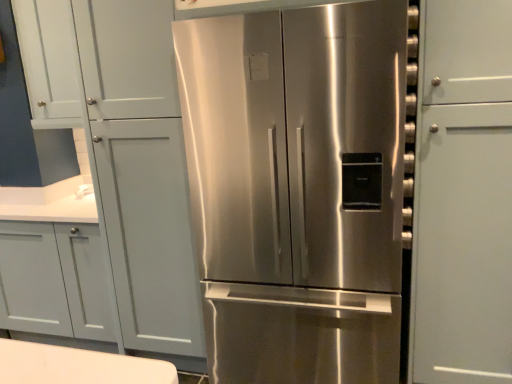
Question: From the image's perspective, is white matte cabinet doors at upper left above or below stainless steel refrigerator at center?

Choices:
 (A) above
 (B) below

Answer: (A)

Question: From a real-world perspective, is white matte cabinet doors at upper left above or below stainless steel refrigerator at center?

Choices:
 (A) above
 (B) below

Answer: (A)

Question: In terms of width, does white matte cabinet doors at upper left look wider or thinner when compared to stainless steel refrigerator at center?

Choices:
 (A) wide
 (B) thin

Answer: (B)

Question: Considering the relative positions of stainless steel refrigerator at center and white matte cabinet doors at upper left in the image provided, is stainless steel refrigerator at center to the left or to the right of white matte cabinet doors at upper left?

Choices:
 (A) right
 (B) left

Answer: (A)

Question: Considering the positions of stainless steel refrigerator at center and white matte cabinet doors at upper left in the image, is stainless steel refrigerator at center taller or shorter than white matte cabinet doors at upper left?

Choices:
 (A) short
 (B) tall

Answer: (B)

Question: Considering the positions of point (314, 102) and point (42, 64), is point (314, 102) closer or farther from the camera than point (42, 64)?

Choices:
 (A) closer
 (B) farther

Answer: (A)

Question: From the image's perspective, is stainless steel refrigerator at center positioned above or below white matte cabinet doors at upper left?

Choices:
 (A) above
 (B) below

Answer: (B)